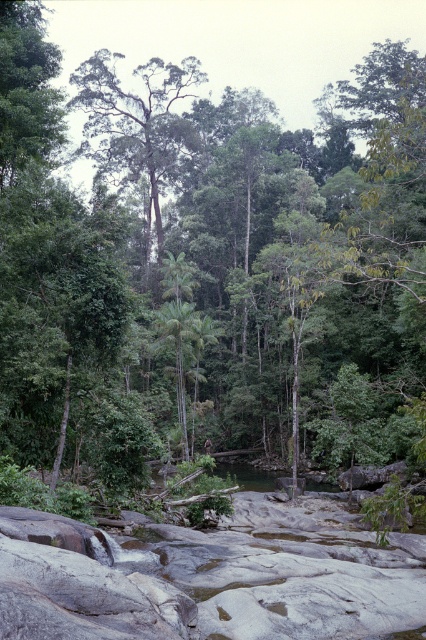
Based on the coordinates provided, which object is located at point (137,125)?

The point (137,125) corresponds to the green leafy tree at upper center.